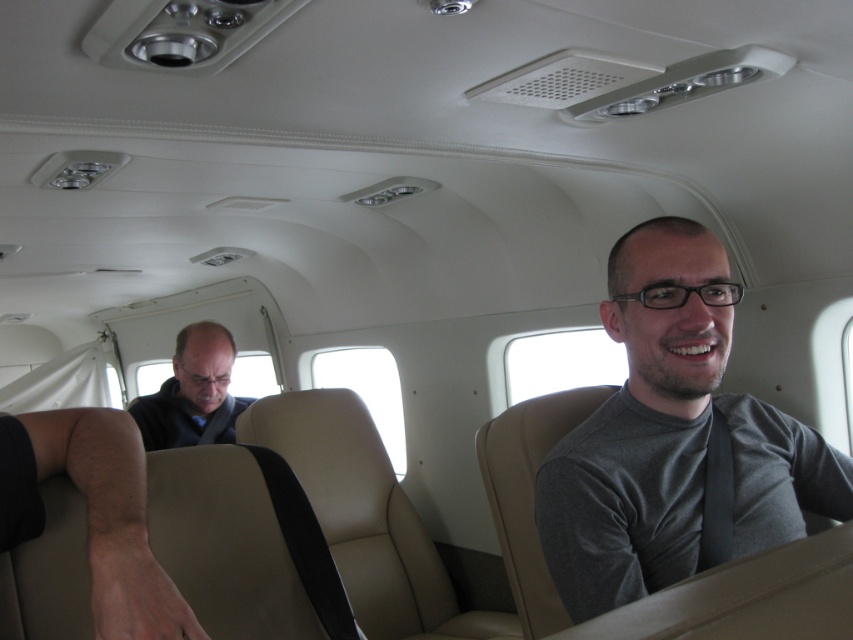
From the picture: You are a flight attendant checking seatbelts in the front row. You see the gray matte shirt at center and the dark brown leather jacket at left. Which passenger should you check first if you start from the left side of the row?

You should check the passenger with the dark brown leather jacket at left first because it is positioned to the left of the gray matte shirt at center.

You are a flight attendant checking passengers during a flight. You notice a passenger wearing a gray matte shirt at center and a dark brown leather jacket at left. Which clothing item is positioned higher on the passenger?

The gray matte shirt at center is much taller than the dark brown leather jacket at left, so the gray matte shirt at center is positioned higher on the passenger.